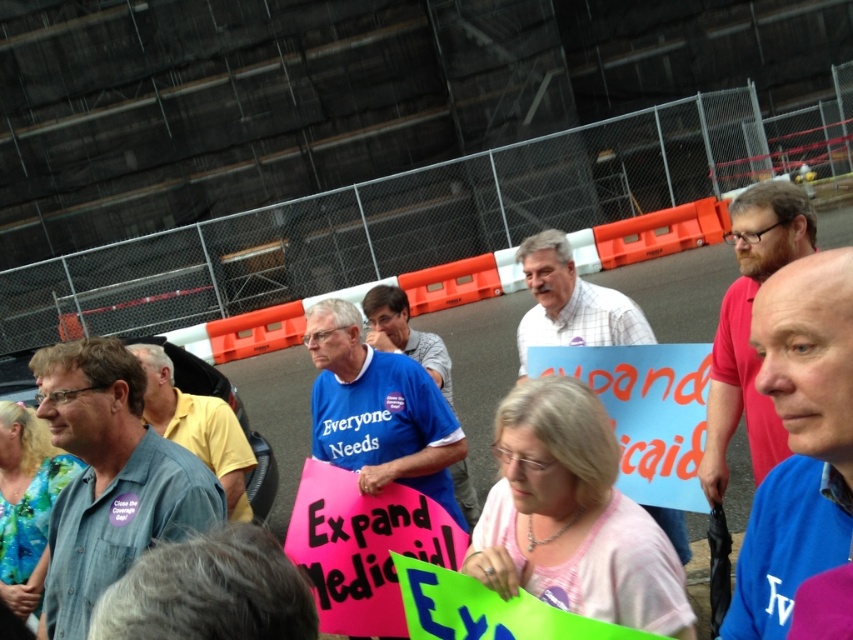
Is blue fabric shirt at center smaller than bearded man at center?

Correct, blue fabric shirt at center occupies less space than bearded man at center.

Can you confirm if blue fabric shirt at center is positioned to the left of bearded man at center?

Correct, you'll find blue fabric shirt at center to the left of bearded man at center.

Is point (819, 273) positioned behind point (746, 324)?

No, (819, 273) is in front of (746, 324).

Identify the location of blue fabric shirt at center. Image resolution: width=853 pixels, height=640 pixels. (799, 442).

Does plaid shirt at center have a greater width compared to blue shirt at center?

Correct, the width of plaid shirt at center exceeds that of blue shirt at center.

Locate an element on the screen. Image resolution: width=853 pixels, height=640 pixels. plaid shirt at center is located at coordinates (572, 301).

Does blue fabric shirt at center appear under white checkered shirt at center?

Correct, blue fabric shirt at center is located below white checkered shirt at center.

Does blue fabric shirt at center have a larger size compared to white checkered shirt at center?

No, blue fabric shirt at center is not bigger than white checkered shirt at center.

Which is in front, point (772, 307) or point (525, 346)?

Point (772, 307)

You are a GUI agent. You are given a task and a screenshot of the screen. Output one action in this format:
    pyautogui.click(x=<x>, y=<y>)
    Task: Click on the blue fabric shirt at center
    
    Given the screenshot: What is the action you would take?
    pyautogui.click(x=799, y=442)